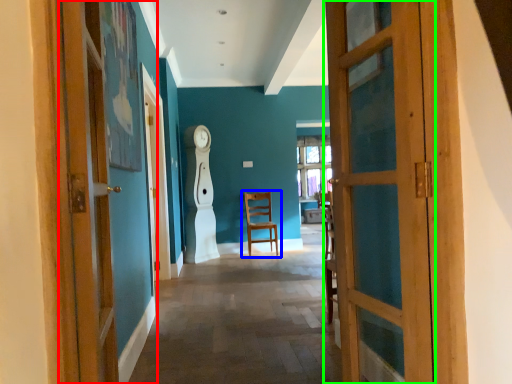
Question: Which is farther away from door (highlighted by a red box)? chair (highlighted by a blue box) or door (highlighted by a green box)?

Choices:
 (A) chair
 (B) door

Answer: (A)